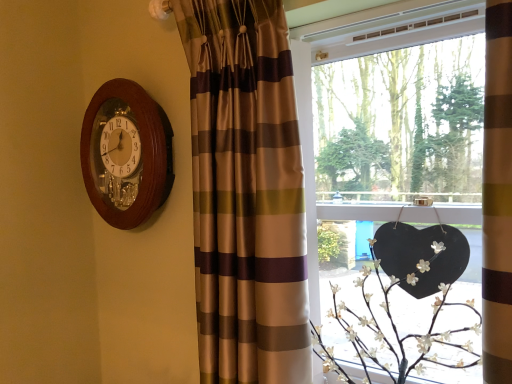
Image resolution: width=512 pixels, height=384 pixels. Describe the element at coordinates (126, 154) in the screenshot. I see `wooden wall clock at upper left` at that location.

Measure the distance between wooden wall clock at upper left and camera.

wooden wall clock at upper left and camera are 1.36 meters apart.

Locate an element on the screen. white matte floral arrangement at lower right is located at coordinates (404, 311).

Locate an element on the screen. The height and width of the screenshot is (384, 512). wooden wall clock at upper left is located at coordinates (126, 154).

Is point (499, 186) positioned in front of point (250, 105)?

That is True.

Considering the sizes of matte black heart at right and brown striped curtain at left in the image, is matte black heart at right bigger or smaller than brown striped curtain at left?

In the image, matte black heart at right appears to be larger than brown striped curtain at left.

From a real-world perspective, between matte black heart at right and brown striped curtain at left, who is vertically higher?

From a 3D spatial view, brown striped curtain at left is above.

Looking at this image, is matte black heart at right at the left side of brown striped curtain at left?

No.

From the image's perspective, is brown striped curtain at left on top of matte black heart at right?

Yes, from the image's perspective, brown striped curtain at left is above matte black heart at right.

Could matte black heart at right be considered to be inside brown striped curtain at left?

That's incorrect, matte black heart at right is not inside brown striped curtain at left.

Is brown striped curtain at left facing away from matte black heart at right?

Yes, brown striped curtain at left is positioned with its back facing matte black heart at right.

Considering the points (269, 239) and (387, 337), which point is in front, point (269, 239) or point (387, 337)?

The point (269, 239) is more forward.

Is brown striped curtain at left positioned behind white matte floral arrangement at lower right?

Yes, it is behind white matte floral arrangement at lower right.

Is brown striped curtain at left bigger than white matte floral arrangement at lower right?

Yes.

From the image's perspective, does brown striped curtain at left appear higher than white matte floral arrangement at lower right?

Yes, from the image's perspective, brown striped curtain at left is above white matte floral arrangement at lower right.

From a real-world perspective, is wooden wall clock at upper left above or below matte black heart at right?

From a real-world perspective, wooden wall clock at upper left is physically above matte black heart at right.

Would you say wooden wall clock at upper left is a long distance from matte black heart at right?

wooden wall clock at upper left is near matte black heart at right, not far away.

Can you confirm if wooden wall clock at upper left is positioned to the left of matte black heart at right?

Indeed, wooden wall clock at upper left is positioned on the left side of matte black heart at right.

Who is shorter, wooden wall clock at upper left or matte black heart at right?

wooden wall clock at upper left is shorter.

The height and width of the screenshot is (384, 512). I want to click on floral arrangement below the matte black heart at right (from the image's perspective), so click(x=404, y=311).

Considering the sizes of objects matte black heart at right and white matte floral arrangement at lower right in the image provided, who is taller, matte black heart at right or white matte floral arrangement at lower right?

matte black heart at right is taller.

Considering the sizes of objects matte black heart at right and white matte floral arrangement at lower right in the image provided, who is smaller, matte black heart at right or white matte floral arrangement at lower right?

With smaller size is white matte floral arrangement at lower right.

How much distance is there between matte black heart at right and white matte floral arrangement at lower right?

10.80 inches.

Which object is positioned more to the left, white matte floral arrangement at lower right or matte black heart at right?

Positioned to the left is matte black heart at right.

Is white matte floral arrangement at lower right aimed at matte black heart at right?

Yes, white matte floral arrangement at lower right is aimed at matte black heart at right.

From the image's perspective, which is below, white matte floral arrangement at lower right or matte black heart at right?

white matte floral arrangement at lower right is shown below in the image.

Consider the image. From the image's perspective, which is above, white matte floral arrangement at lower right or brown striped curtain at left?

brown striped curtain at left, from the image's perspective.

Is white matte floral arrangement at lower right completely or partially outside of brown striped curtain at left?

That's correct, white matte floral arrangement at lower right is outside of brown striped curtain at left.

Considering the positions of objects white matte floral arrangement at lower right and brown striped curtain at left in the image provided, who is more to the right, white matte floral arrangement at lower right or brown striped curtain at left?

white matte floral arrangement at lower right is more to the right.

Locate an element on the screen. This screenshot has width=512, height=384. window beneath the brown striped curtain at left (from a real-world perspective) is located at coordinates (312, 128).

Locate an element on the screen. This screenshot has height=384, width=512. curtain that is above the matte black heart at right (from a real-world perspective) is located at coordinates (246, 193).

Estimate the real-world distances between objects in this image. Which object is closer to matte black heart at right, white matte floral arrangement at lower right or wooden wall clock at upper left?

white matte floral arrangement at lower right is closer to matte black heart at right.

In the scene shown: When comparing their distances from wooden wall clock at upper left, does matte black heart at right or brown striped curtain at left seem closer?

brown striped curtain at left is closer to wooden wall clock at upper left.

From the image, which object appears to be nearer to wooden wall clock at upper left, brown striped curtain at left or white matte floral arrangement at lower right?

The object closer to wooden wall clock at upper left is brown striped curtain at left.

Considering their positions, is brown striped curtain at left positioned closer to wooden wall clock at upper left than matte black heart at right?

The object closer to wooden wall clock at upper left is brown striped curtain at left.

Estimate the real-world distances between objects in this image. Which object is closer to white matte floral arrangement at lower right, brown striped curtain at left or matte black heart at right?

Among the two, matte black heart at right is located nearer to white matte floral arrangement at lower right.

Looking at the image, which one is located further to matte black heart at right, brown striped curtain at left or wooden wall clock at upper left?

wooden wall clock at upper left.

Based on their spatial positions, is matte black heart at right or brown striped curtain at left closer to white matte floral arrangement at lower right?

matte black heart at right.

Considering their positions, is matte black heart at right positioned closer to wooden wall clock at upper left than white matte floral arrangement at lower right?

The object closer to wooden wall clock at upper left is matte black heart at right.

Image resolution: width=512 pixels, height=384 pixels. What are the coordinates of `curtain situated between wooden wall clock at upper left and white matte floral arrangement at lower right from left to right` in the screenshot? It's located at (246, 193).

Locate an element on the screen. The image size is (512, 384). window between brown striped curtain at left and white matte floral arrangement at lower right from left to right is located at coordinates 312,128.

The image size is (512, 384). I want to click on curtain between wooden wall clock at upper left and matte black heart at right from left to right, so click(x=246, y=193).

This screenshot has width=512, height=384. Find the location of `window between wooden wall clock at upper left and white matte floral arrangement at lower right in the horizontal direction`. window between wooden wall clock at upper left and white matte floral arrangement at lower right in the horizontal direction is located at coordinates (312, 128).